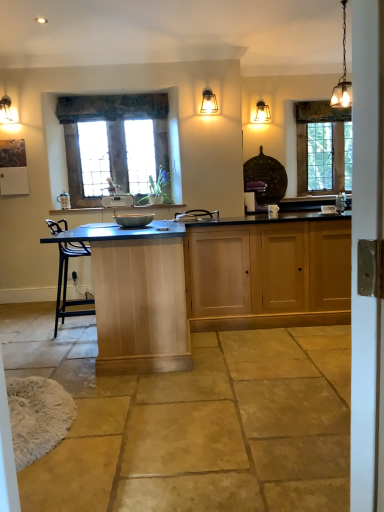
Question: From the image's perspective, is white plastic radio at center, the 1th appliance in the left-to-right sequence, located above or below stained glass window at center, which appears as the 2th window when viewed from the back?

Choices:
 (A) below
 (B) above

Answer: (A)

Question: In terms of size, does white plastic radio at center, acting as the second appliance starting from the front, appear bigger or smaller than stained glass window at center, marked as the 1th window in a left-to-right arrangement?

Choices:
 (A) big
 (B) small

Answer: (B)

Question: Based on their relative distances, which object is nearer to the light oak cabinet at center, the second cabinetry from the left?

Choices:
 (A) white glossy sink at center
 (B) textured fabric curtain at upper center
 (C) matte glass pendant light at upper center, positioned as the 1th light fixture in back-to-front order
 (D) stained glass window at upper right, the first window viewed from the back
 (E) stained glass window at center, which appears as the 2th window when viewed from the back

Answer: (A)

Question: Considering the real-world distances, which object is closest to the stained glass window at center, marked as the 1th window in a left-to-right arrangement?

Choices:
 (A) white plastic radio at center, which ranks as the 1th appliance in back-to-front order
 (B) white glossy sink at center
 (C) textured fabric curtain at upper center
 (D) light wood cabinet at center, marked as the 2th cabinetry in a right-to-left arrangement
 (E) light oak cabinet at center, the first cabinetry positioned from the right

Answer: (C)